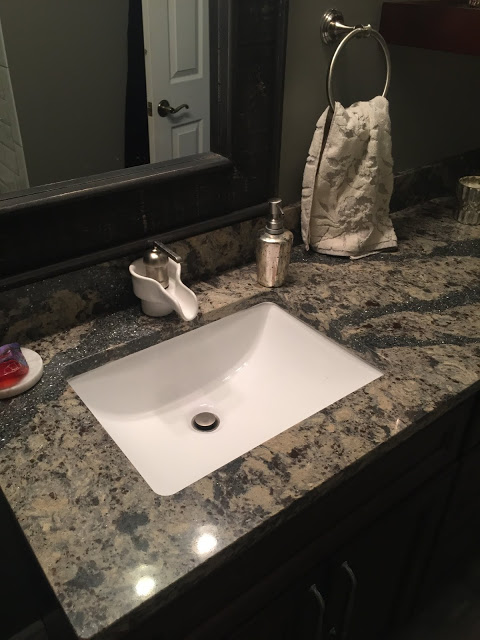
Where is `countertop`? This screenshot has height=640, width=480. countertop is located at coordinates (148, 553).